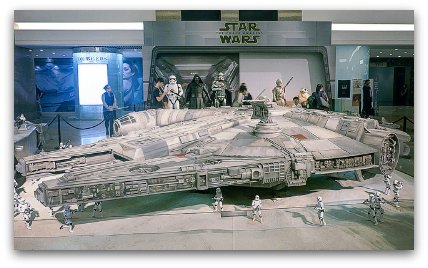
Where is `information screen`? This screenshot has height=268, width=428. information screen is located at coordinates (91, 78).